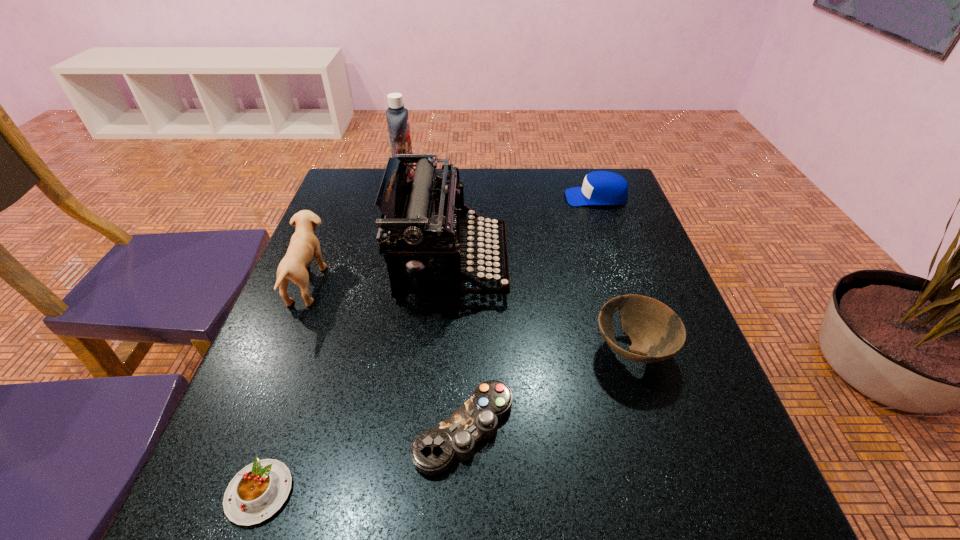
You are a GUI agent. You are given a task and a screenshot of the screen. Output one action in this format:
    pyautogui.click(x=<x>, y=<y>)
    Task: Click on the farthest object
    
    Given the screenshot: What is the action you would take?
    (x=397, y=117)

Locate an element on the screen. This screenshot has height=540, width=960. typewriter is located at coordinates click(x=425, y=220).

This screenshot has width=960, height=540. Identify the location of puppy. (304, 245).

Find the location of a particular element. This screenshot has width=960, height=540. bowl is located at coordinates click(655, 330).

You are a GUI agent. You are given a task and a screenshot of the screen. Output one action in this format:
    pyautogui.click(x=<x>, y=<y>)
    Task: Click on the second farthest object
    This screenshot has width=960, height=540.
    Given the screenshot: What is the action you would take?
    pyautogui.click(x=599, y=187)

The width and height of the screenshot is (960, 540). Identify the location of control. (433, 451).

Find the location of `pudding`. pudding is located at coordinates (258, 491).

You are a GUI agent. You are given a task and a screenshot of the screen. Output one action in this format:
    pyautogui.click(x=<x>, y=<y>)
    Task: Click on the free space located on the front label of the farthest object
    Image resolution: width=960 pixels, height=540 pixels.
    Given the screenshot: What is the action you would take?
    pyautogui.click(x=490, y=178)

Identify the location of blank space located 0.320m on the typing side of the typewriter. Image resolution: width=960 pixels, height=540 pixels. (639, 265).

Identify the location of free location located on the left side of the third tallest object. This screenshot has width=960, height=540. (371, 284).